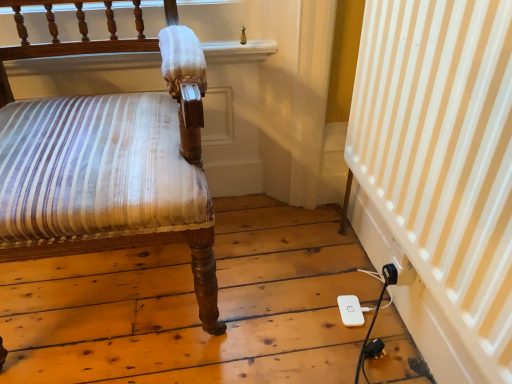
Find the location of a particular element. The width and height of the screenshot is (512, 384). white striped curtain at lower right is located at coordinates (x=443, y=157).

I want to click on white plastic ipod at lower right, so point(350,310).

From the picture: From a real-world perspective, which is physically above, matte brown wood chair at left or white plastic ipod at lower right?

matte brown wood chair at left, from a real-world perspective.

How many degrees apart are the facing directions of matte brown wood chair at left and white plastic ipod at lower right?

matte brown wood chair at left and white plastic ipod at lower right are facing 95.5 degrees away from each other.

In terms of size, does matte brown wood chair at left appear bigger or smaller than white plastic ipod at lower right?

In the image, matte brown wood chair at left appears to be larger than white plastic ipod at lower right.

Can we say matte brown wood chair at left lies outside white plastic ipod at lower right?

Yes.

From the image's perspective, which one is positioned higher, matte brown wood chair at left or white striped curtain at lower right?

From the image's view, matte brown wood chair at left is above.

From a real-world perspective, is matte brown wood chair at left located higher than white striped curtain at lower right?

Indeed, from a real-world perspective, matte brown wood chair at left stands above white striped curtain at lower right.

Consider the image. Can you tell me how much matte brown wood chair at left and white striped curtain at lower right differ in facing direction?

88.2 degrees separate the facing orientations of matte brown wood chair at left and white striped curtain at lower right.

Between matte brown wood chair at left and white striped curtain at lower right, which one has more height?

Standing taller between the two is matte brown wood chair at left.

Identify the location of curtain in front of the matte brown wood chair at left. This screenshot has width=512, height=384. point(443,157).

Can you confirm if white striped curtain at lower right is shorter than matte brown wood chair at left?

Indeed, white striped curtain at lower right has a lesser height compared to matte brown wood chair at left.

How different are the orientations of white striped curtain at lower right and matte brown wood chair at left in degrees?

There is a 88.2-degree angle between the facing directions of white striped curtain at lower right and matte brown wood chair at left.

Is white striped curtain at lower right to the right of matte brown wood chair at left from the viewer's perspective?

Indeed, white striped curtain at lower right is positioned on the right side of matte brown wood chair at left.

Could you tell me if white plastic ipod at lower right is facing matte brown wood chair at left?

No, white plastic ipod at lower right does not turn towards matte brown wood chair at left.

Between point (349, 295) and point (23, 115), which one is positioned behind?

Point (349, 295)

Is white plastic ipod at lower right in front of or behind matte brown wood chair at left in the image?

Clearly, white plastic ipod at lower right is behind matte brown wood chair at left.

Who is taller, white plastic ipod at lower right or matte brown wood chair at left?

Standing taller between the two is matte brown wood chair at left.

Is white striped curtain at lower right facing towards white plastic ipod at lower right?

Yes, white striped curtain at lower right is oriented towards white plastic ipod at lower right.

Is white plastic ipod at lower right completely or partially inside white striped curtain at lower right?

Actually, white plastic ipod at lower right is outside white striped curtain at lower right.

Which is more to the left, white striped curtain at lower right or white plastic ipod at lower right?

Positioned to the left is white plastic ipod at lower right.

What are the coordinates of `ipod located underneath the white striped curtain at lower right (from a real-world perspective)` in the screenshot? It's located at (x=350, y=310).

Does white plastic ipod at lower right have a greater width compared to white striped curtain at lower right?

In fact, white plastic ipod at lower right might be narrower than white striped curtain at lower right.

From the image's perspective, does white plastic ipod at lower right appear lower than white striped curtain at lower right?

Correct, white plastic ipod at lower right appears lower than white striped curtain at lower right in the image.

Can you confirm if white plastic ipod at lower right is taller than white striped curtain at lower right?

No.

Is white plastic ipod at lower right outside of white striped curtain at lower right?

white plastic ipod at lower right lies outside white striped curtain at lower right's area.

The image size is (512, 384). I want to click on ipod behind the matte brown wood chair at left, so click(x=350, y=310).

Find the location of a particular element. chair to the left of white striped curtain at lower right is located at coordinates (109, 157).

Estimate the real-world distances between objects in this image. Which object is further from white plastic ipod at lower right, white striped curtain at lower right or matte brown wood chair at left?

matte brown wood chair at left is further to white plastic ipod at lower right.

Based on their spatial positions, is matte brown wood chair at left or white striped curtain at lower right closer to white plastic ipod at lower right?

white striped curtain at lower right.

Considering their positions, is white plastic ipod at lower right positioned further to matte brown wood chair at left than white striped curtain at lower right?

Based on the image, white plastic ipod at lower right appears to be further to matte brown wood chair at left.

Consider the image. From the image, which object appears to be farther from matte brown wood chair at left, white striped curtain at lower right or white plastic ipod at lower right?

The object further to matte brown wood chair at left is white plastic ipod at lower right.

Which object lies further to the anchor point white striped curtain at lower right, white plastic ipod at lower right or matte brown wood chair at left?

matte brown wood chair at left lies further to white striped curtain at lower right than the other object.

In the scene shown: Which object lies nearer to the anchor point white striped curtain at lower right, matte brown wood chair at left or white plastic ipod at lower right?

white plastic ipod at lower right is closer to white striped curtain at lower right.

Where is `ipod located between matte brown wood chair at left and white striped curtain at lower right in the left-right direction`? The height and width of the screenshot is (384, 512). ipod located between matte brown wood chair at left and white striped curtain at lower right in the left-right direction is located at coordinates (350, 310).